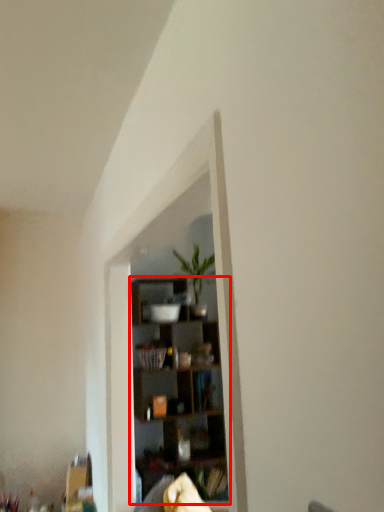
Question: Observing the image, what is the correct spatial positioning of shelf (annotated by the red box) in reference to houseplant?

Choices:
 (A) left
 (B) right

Answer: (A)